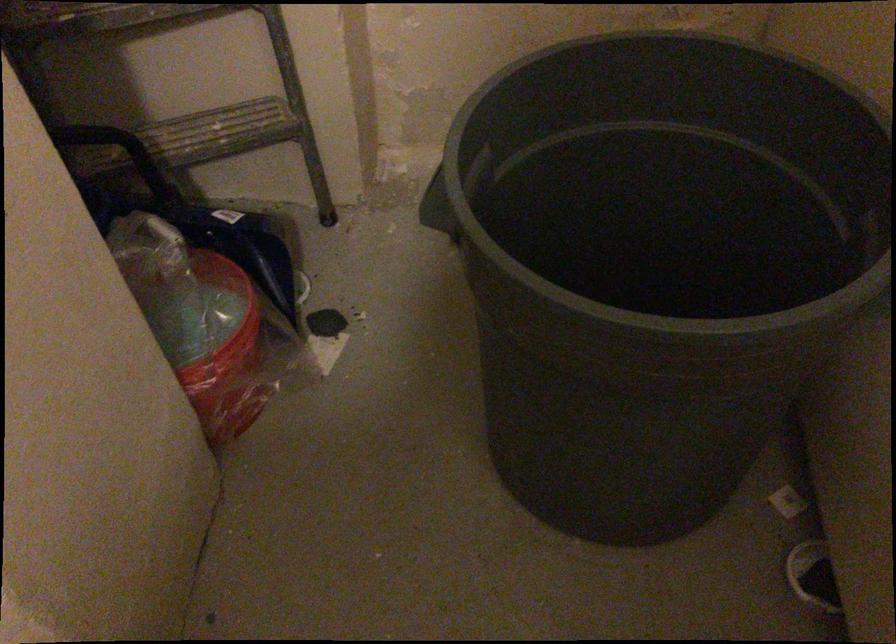
Which object does [190,307] point to?

It refers to a red plastic bucket.